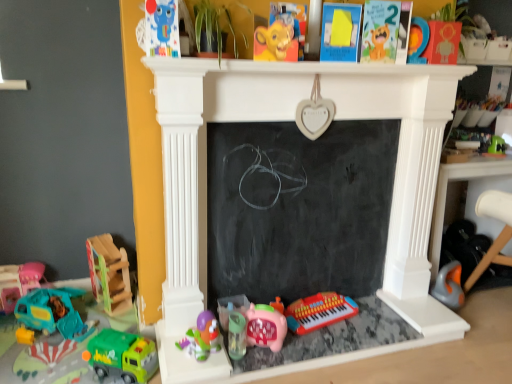
This screenshot has height=384, width=512. What are the coordinates of `unoccupied area in front of teal plastic toy car at lower left, placed as the 11th toy when sorted from right to left` in the screenshot? It's located at (32, 360).